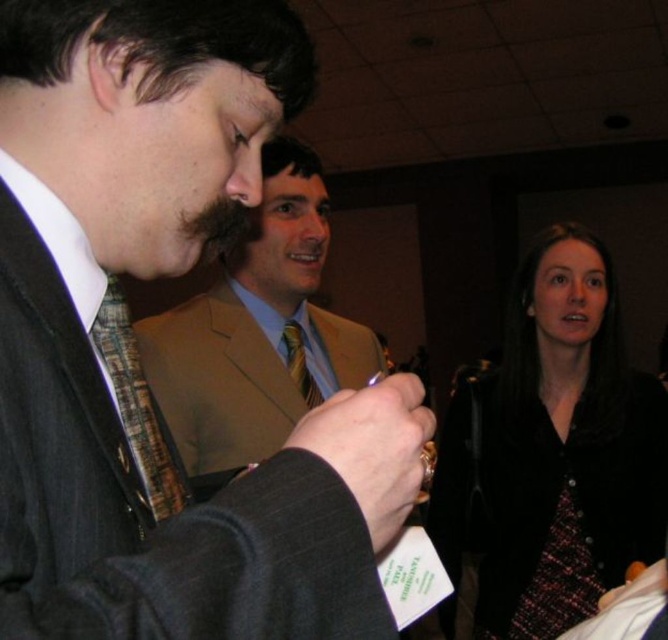
Who is more forward, [611,582] or [106,365]?

Point [106,365] is more forward.

Is point (617, 364) farther from viewer compared to point (104, 349)?

Yes, it is behind point (104, 349).

You are a GUI agent. You are given a task and a screenshot of the screen. Output one action in this format:
    pyautogui.click(x=<x>, y=<y>)
    Task: Click on the black velvet jacket at lower right
    
    Given the screenshot: What is the action you would take?
    pyautogui.click(x=550, y=452)

Is black velvet jacket at lower right taller than light brown suit at center?

Yes.

You are a GUI agent. You are given a task and a screenshot of the screen. Output one action in this format:
    pyautogui.click(x=<x>, y=<y>)
    Task: Click on the black velvet jacket at lower right
    The height and width of the screenshot is (640, 668).
    Given the screenshot: What is the action you would take?
    pyautogui.click(x=550, y=452)

Which is behind, point (663, 504) or point (261, 449)?

The point (663, 504) is behind.

Locate an element on the screen. Image resolution: width=668 pixels, height=640 pixels. black velvet jacket at lower right is located at coordinates (550, 452).

Is point (69, 604) more distant than point (120, 292)?

That is False.

Between point (63, 150) and point (184, 483), which one is positioned behind?

Positioned behind is point (184, 483).

The image size is (668, 640). Find the location of `matte black suit at center`. matte black suit at center is located at coordinates (124, 336).